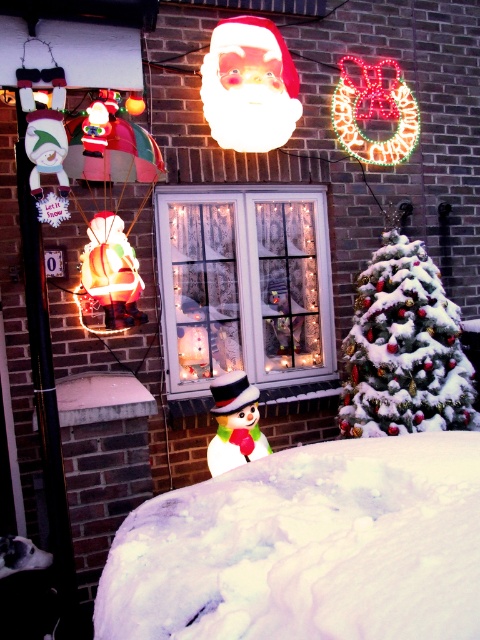
You are standing in front of the Christmas scene described. There is a point at coordinates point (243, 285). Which object from the list contains this point?

The point (243, 285) is located on the white frosted glass window at center.

You are standing in front of the Christmas scene and want to touch both points. Which point should you reach for first, point (247, 289) or point (235, 403)?

You should reach for point (247, 289) first because it is closer to you than point (235, 403).